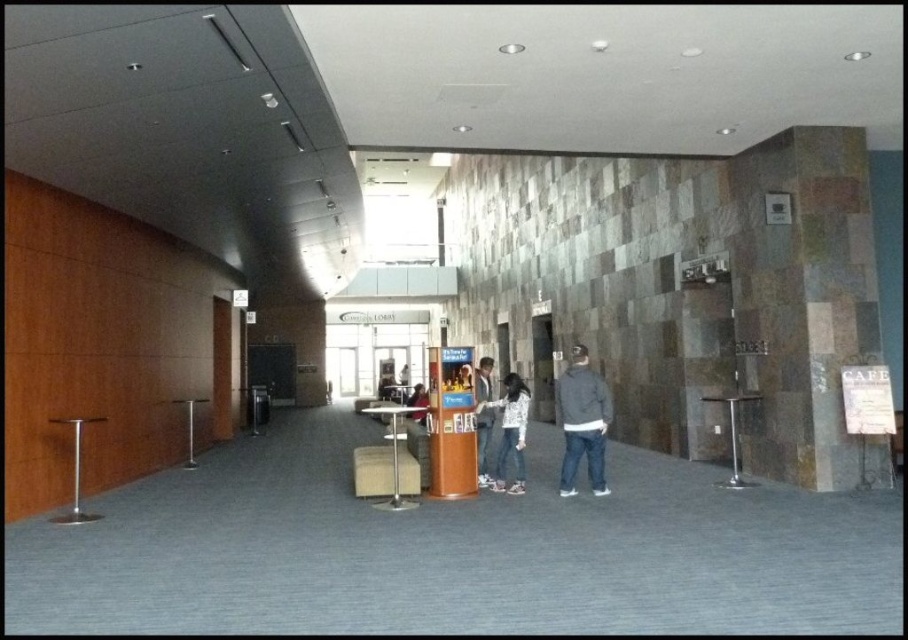
Does matte gray jacket at center appear on the left side of matte black jacket at center?

Incorrect, matte gray jacket at center is not on the left side of matte black jacket at center.

How distant is matte gray jacket at center from matte black jacket at center?

They are 5.57 feet apart.

Find the location of a particular element. This screenshot has height=640, width=908. matte gray jacket at center is located at coordinates (482, 419).

Between point (577, 374) and point (495, 484), which one is positioned behind?

The point (495, 484) is more distant.

Where is `dark gray hoodie at center`? The width and height of the screenshot is (908, 640). dark gray hoodie at center is located at coordinates (581, 422).

Where is `dark gray hoodie at center`? The image size is (908, 640). dark gray hoodie at center is located at coordinates (581, 422).

Who is positioned more to the left, metallic silver stool at center or matte black jacket at center?

From the viewer's perspective, matte black jacket at center appears more on the left side.

Is point (369, 480) in front of point (417, 410)?

That is True.

At what (x,y) coordinates should I click in order to perform the action: click on metallic silver stool at center. Please return your answer as a coordinate pair (x, y). The height and width of the screenshot is (640, 908). Looking at the image, I should click on (383, 472).